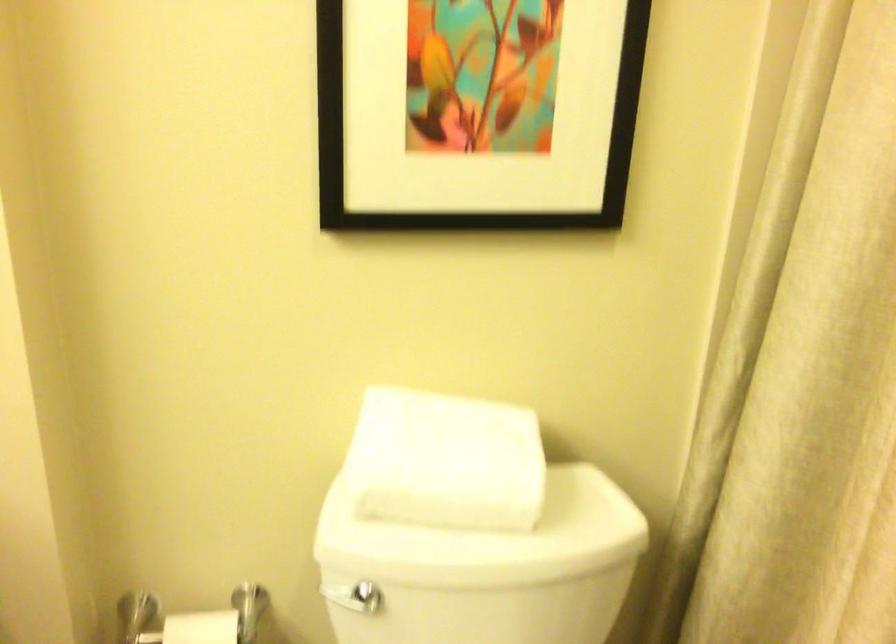
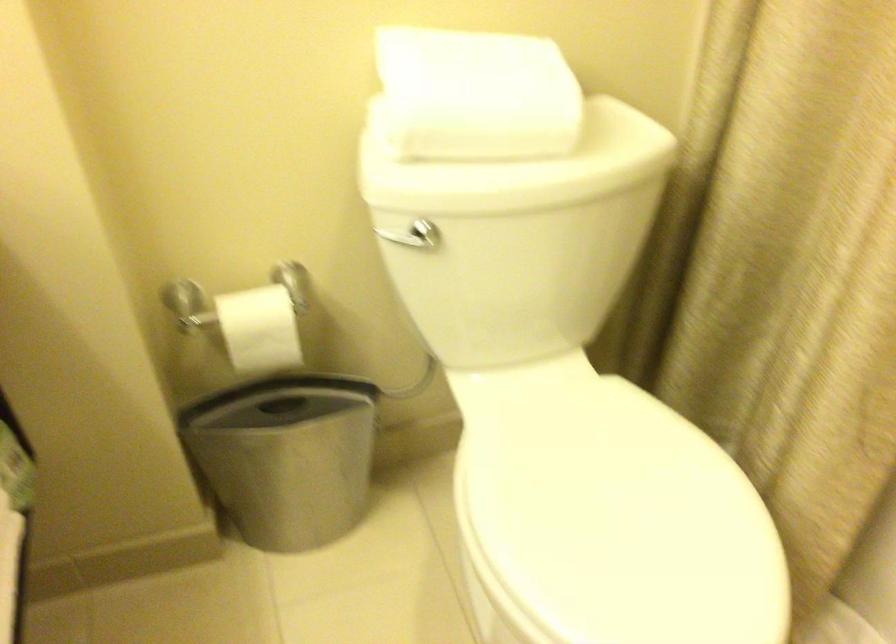
Question: Based on the continuous images, in which direction is the camera rotating? Reply with the corresponding letter.

Choices:
 (A) Left
 (B) Right
 (C) Up
 (D) Down

Answer: (D)